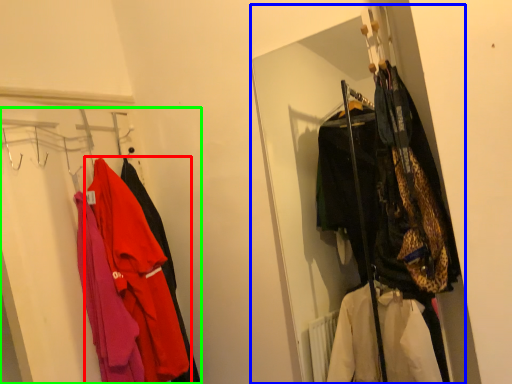
Question: Estimate the real-world distances between objects in this image. Which object is farther from jacket (highlighted by a red box), closet (highlighted by a blue box) or closet (highlighted by a green box)?

Choices:
 (A) closet
 (B) closet

Answer: (A)